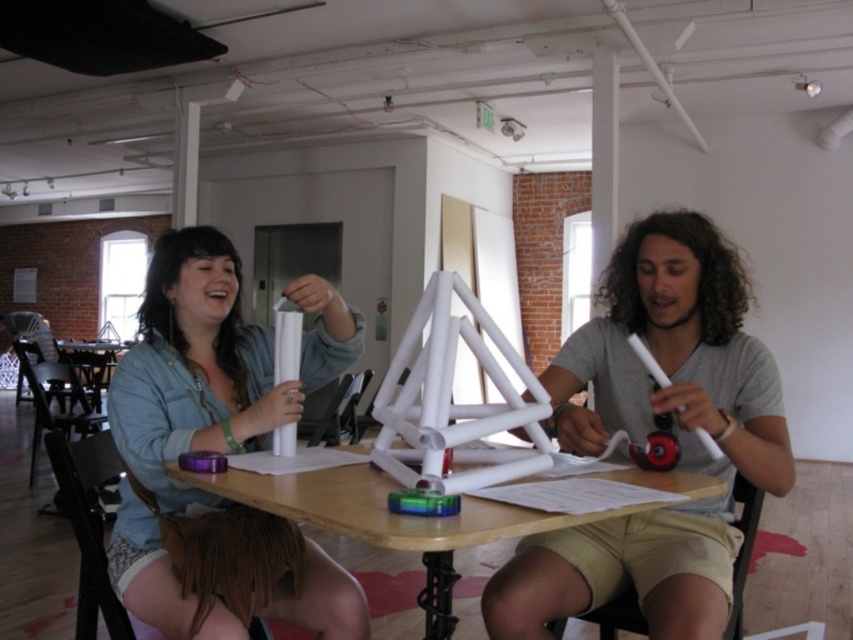
Question: Among these points, which one is farthest from the camera?

Choices:
 (A) (445, 628)
 (B) (720, 404)
 (C) (228, 353)

Answer: (C)

Question: Which point is closer to the camera taking this photo?

Choices:
 (A) (654, 474)
 (B) (222, 336)

Answer: (A)

Question: In this image, where is white matte triangle at center located relative to matte white paper at center?

Choices:
 (A) above
 (B) below

Answer: (B)

Question: Can you confirm if white matte triangle at center is bigger than matte white paper at center?

Choices:
 (A) yes
 (B) no

Answer: (A)

Question: Does white matte triangle at center have a lesser width compared to matte white paper at center?

Choices:
 (A) no
 (B) yes

Answer: (A)

Question: Which point appears farthest from the camera in this image?

Choices:
 (A) (200, 323)
 (B) (439, 582)
 (C) (521, 602)

Answer: (A)